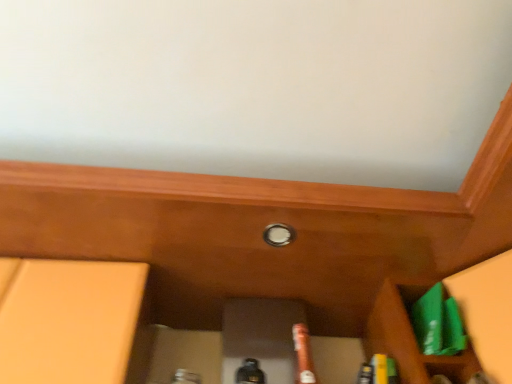
Question: Considering the relative sizes of brown matte beer bottle at center and green plastic bag at lower right in the image provided, is brown matte beer bottle at center wider than green plastic bag at lower right?

Choices:
 (A) yes
 (B) no

Answer: (B)

Question: Is brown matte beer bottle at center in front of green plastic bag at lower right?

Choices:
 (A) no
 (B) yes

Answer: (B)

Question: Does brown matte beer bottle at center have a lesser width compared to green plastic bag at lower right?

Choices:
 (A) no
 (B) yes

Answer: (B)

Question: Considering the relative sizes of brown matte beer bottle at center and green plastic bag at lower right in the image provided, is brown matte beer bottle at center bigger than green plastic bag at lower right?

Choices:
 (A) no
 (B) yes

Answer: (B)

Question: From a real-world perspective, is brown matte beer bottle at center on green plastic bag at lower right?

Choices:
 (A) no
 (B) yes

Answer: (A)

Question: Is green plastic bag at lower right inside the boundaries of brown matte beer bottle at center, or outside?

Choices:
 (A) inside
 (B) outside

Answer: (B)

Question: Does point (445, 372) appear closer or farther from the camera than point (297, 322)?

Choices:
 (A) farther
 (B) closer

Answer: (B)

Question: In the image, is green plastic bag at lower right positioned in front of or behind brown matte beer bottle at center?

Choices:
 (A) behind
 (B) front

Answer: (A)

Question: From a real-world perspective, is green plastic bag at lower right positioned above or below brown matte beer bottle at center?

Choices:
 (A) below
 (B) above

Answer: (B)

Question: Considering the positions of green plastic bag at lower right and white glossy knob at center in the image, is green plastic bag at lower right taller or shorter than white glossy knob at center?

Choices:
 (A) short
 (B) tall

Answer: (B)

Question: Based on their sizes in the image, would you say green plastic bag at lower right is bigger or smaller than white glossy knob at center?

Choices:
 (A) small
 (B) big

Answer: (B)

Question: In the image, is green plastic bag at lower right on the left side or the right side of white glossy knob at center?

Choices:
 (A) right
 (B) left

Answer: (A)

Question: Is green plastic bag at lower right inside the boundaries of white glossy knob at center, or outside?

Choices:
 (A) outside
 (B) inside

Answer: (A)

Question: Is brown matte beer bottle at center situated inside green plastic bag at lower right or outside?

Choices:
 (A) outside
 (B) inside

Answer: (A)

Question: Looking at the image, does brown matte beer bottle at center seem bigger or smaller compared to green plastic bag at lower right?

Choices:
 (A) big
 (B) small

Answer: (A)